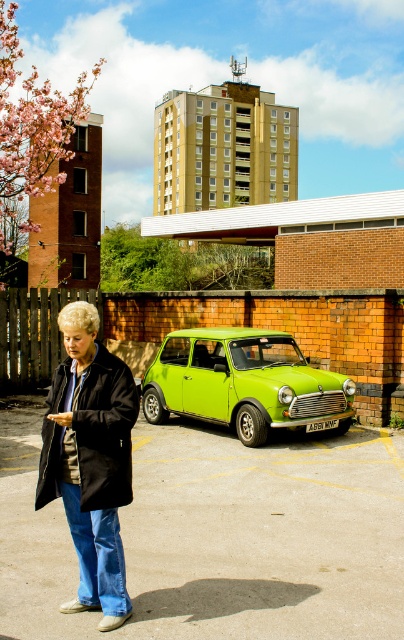
Can you confirm if matte black coat at center is positioned to the left of lime green metallic car at center?

Yes, matte black coat at center is to the left of lime green metallic car at center.

Can you confirm if matte black coat at center is positioned to the right of lime green metallic car at center?

In fact, matte black coat at center is to the left of lime green metallic car at center.

This screenshot has width=404, height=640. Find the location of `matte black coat at center`. matte black coat at center is located at coordinates (90, 460).

Locate an element on the screen. matte black coat at center is located at coordinates (90, 460).

Looking at this image, does smooth asphalt parking lot at center have a smaller size compared to lime green metallic car at center?

Correct, smooth asphalt parking lot at center occupies less space than lime green metallic car at center.

This screenshot has height=640, width=404. In order to click on smooth asphalt parking lot at center in this screenshot , I will do `click(218, 536)`.

Is point (399, 561) positioned behind point (263, 346)?

No, it is in front of (263, 346).

Find the location of a particular element. smooth asphalt parking lot at center is located at coordinates (218, 536).

Who is shorter, smooth asphalt parking lot at center or matte black coat at center?

smooth asphalt parking lot at center is shorter.

Does smooth asphalt parking lot at center appear on the right side of matte black coat at center?

Indeed, smooth asphalt parking lot at center is positioned on the right side of matte black coat at center.

Between point (140, 424) and point (132, 412), which one is positioned behind?

The point (140, 424) is behind.

Identify the location of smooth asphalt parking lot at center. (218, 536).